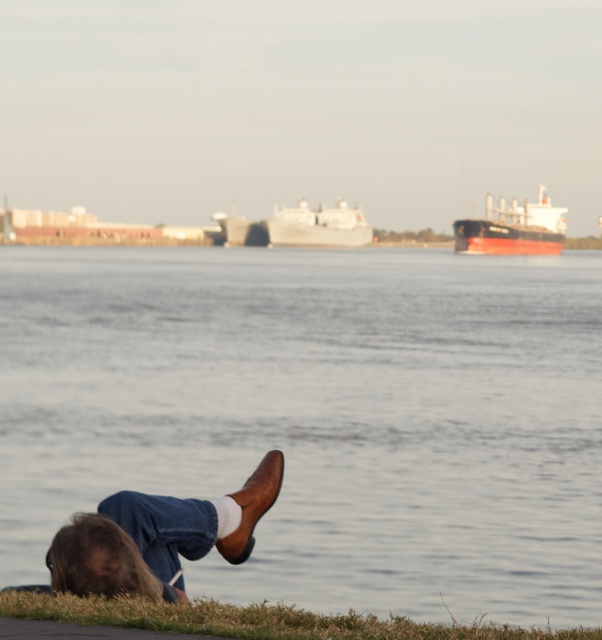
Question: From the image, what is the correct spatial relationship of gray matte ship at center in relation to metallic gray ship at center?

Choices:
 (A) left
 (B) right

Answer: (B)

Question: Which object appears farthest from the camera in this image?

Choices:
 (A) gray matte ship at center
 (B) brown leather shoe at lower center
 (C) green grass at lower center
 (D) red matte cargo ship at upper center

Answer: (A)

Question: Which of the following is the closest to the observer?

Choices:
 (A) (379, 630)
 (B) (350, 518)
 (C) (515, 218)

Answer: (A)

Question: Which object is farther from the camera taking this photo?

Choices:
 (A) metallic gray ship at center
 (B) green grass at lower center
 (C) brown leather shoe at lower center
 (D) gray matte ship at center

Answer: (A)

Question: Does red matte cargo ship at upper center appear over metallic gray ship at center?

Choices:
 (A) yes
 (B) no

Answer: (A)

Question: Is gray matte ship at center thinner than metallic gray ship at center?

Choices:
 (A) yes
 (B) no

Answer: (B)